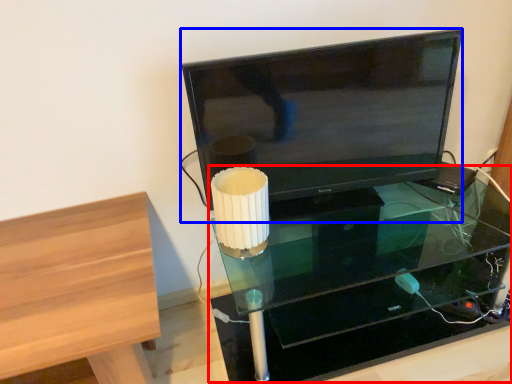
Question: Among these objects, which one is farthest to the camera, table (highlighted by a red box) or television (highlighted by a blue box)?

Choices:
 (A) table
 (B) television

Answer: (B)